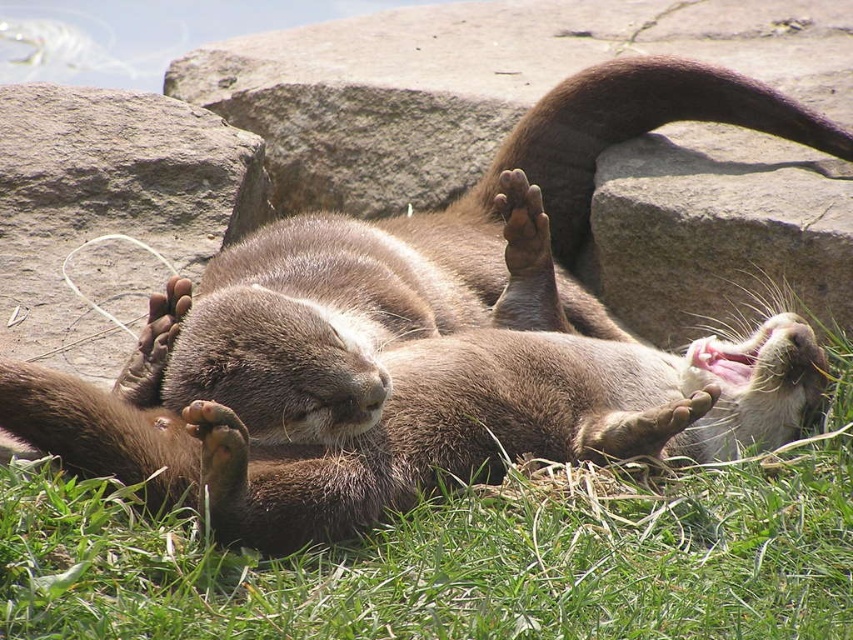
Question: In this image, where is gray rock at upper center located relative to brown furry paw at center?

Choices:
 (A) left
 (B) right

Answer: (A)

Question: Can you confirm if gray rock at upper center is positioned to the left of brown furry paw at center?

Choices:
 (A) no
 (B) yes

Answer: (B)

Question: Which point is farther to the camera?

Choices:
 (A) gray rock at upper center
 (B) brown furry paw at center

Answer: (B)

Question: Which point is closer to the camera?

Choices:
 (A) (535, 273)
 (B) (74, 177)

Answer: (A)

Question: Is green soft grass at lower center wider than gray rock at upper center?

Choices:
 (A) yes
 (B) no

Answer: (A)

Question: Which of the following is the farthest from the observer?

Choices:
 (A) gray rock at upper center
 (B) green soft grass at lower center

Answer: (A)